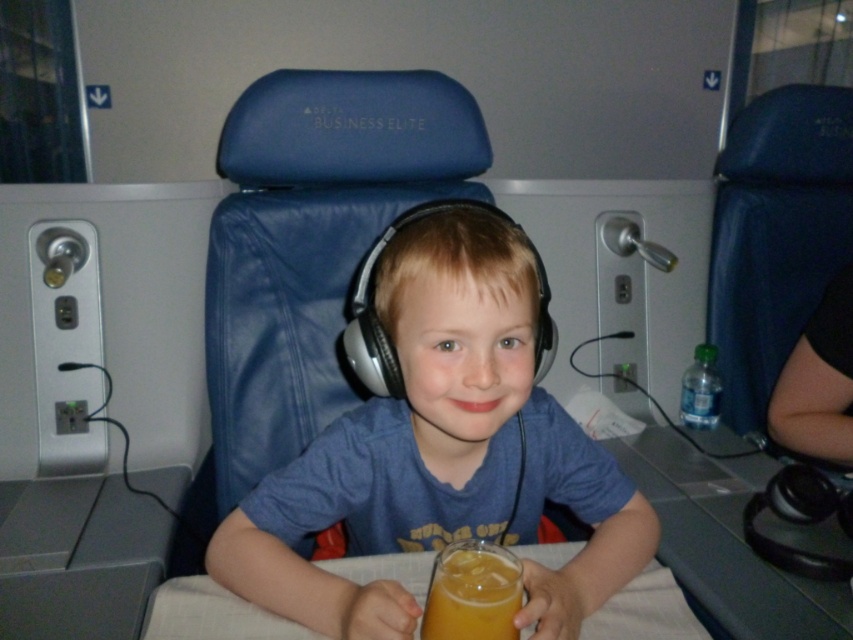
Where is the translucent glass at center located in the image?

The translucent glass at center is located at point coordinates of 0.927 on the x axis and 0.555 on the y axis.

You are a flight attendant checking the seating area. You notice the matte blue headphones at center and the translucent glass at center. Which object is bigger?

The matte blue headphones at center are larger in size than the translucent glass at center.